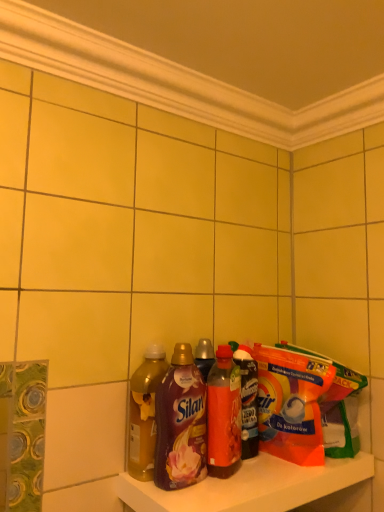
Find the location of a particular element. vacant space in front of orange plastic bag at shelf right is located at coordinates (266, 478).